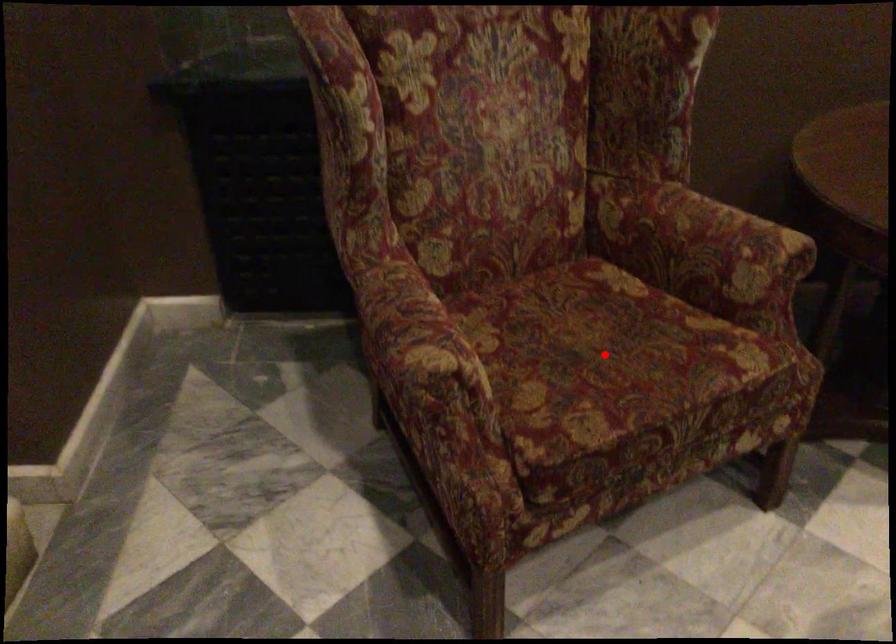
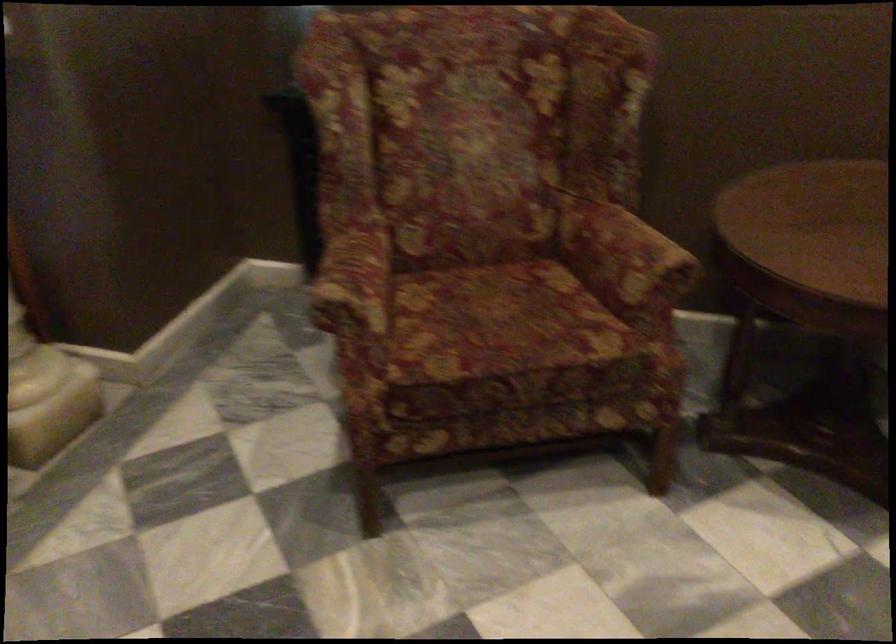
Question: A red point is marked in image1. In image2, is the corresponding 3D point closer to the camera or farther? Reply with the corresponding letter.

Choices:
 (A) The corresponding 3D point is closer.
 (B) The corresponding 3D point is farther.

Answer: (B)